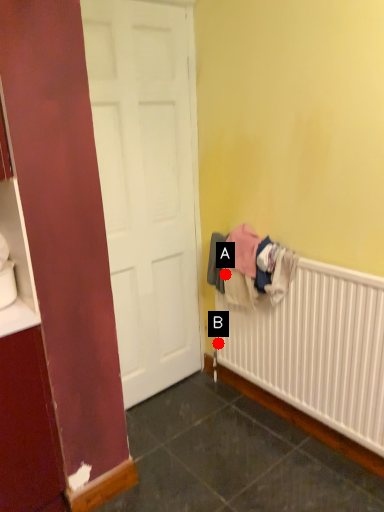
Question: Two points are circled on the image, labeled by A and B beside each circle. Which of the following is the farthest from the observer?

Choices:
 (A) A is further
 (B) B is further

Answer: (B)